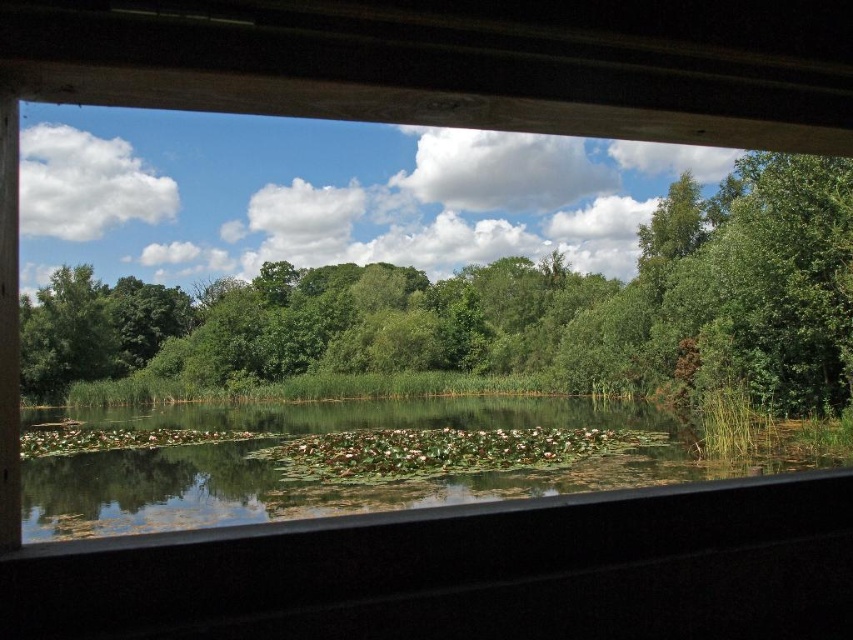
The height and width of the screenshot is (640, 853). What do you see at coordinates (503, 308) in the screenshot?
I see `green leafy tree at upper center` at bounding box center [503, 308].

Can you confirm if green leafy tree at upper center is shorter than green leafy water at center?

No.

Image resolution: width=853 pixels, height=640 pixels. Describe the element at coordinates (503, 308) in the screenshot. I see `green leafy tree at upper center` at that location.

This screenshot has width=853, height=640. In order to click on green leafy tree at upper center in this screenshot , I will do `click(503, 308)`.